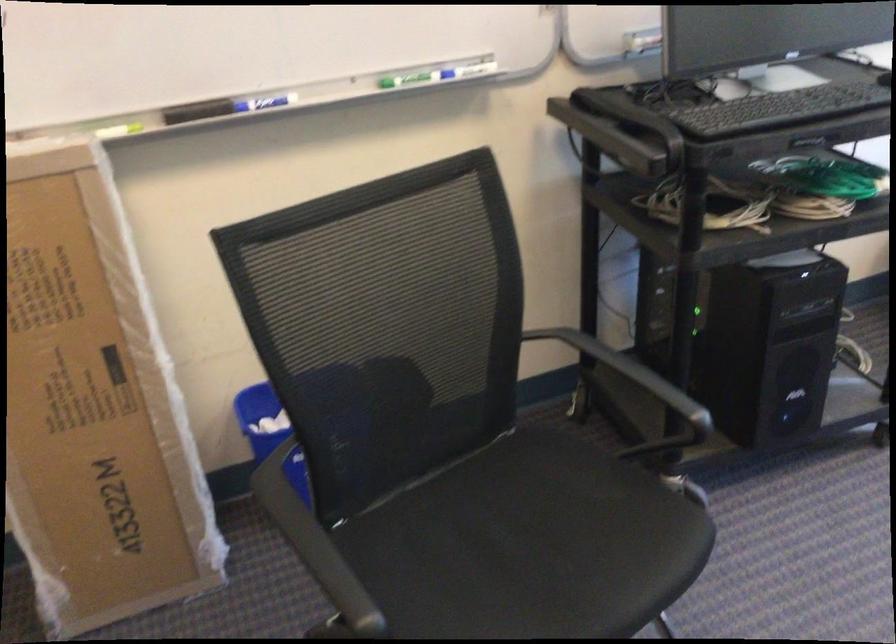
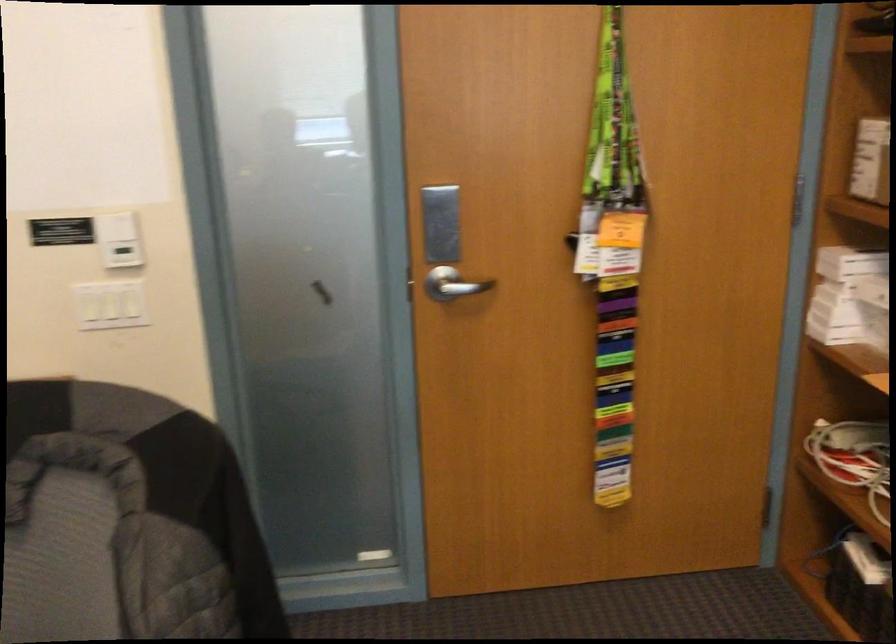
The images are taken continuously from a first-person perspective. In which direction is your viewpoint rotating?

The camera's rotation is toward left-down.